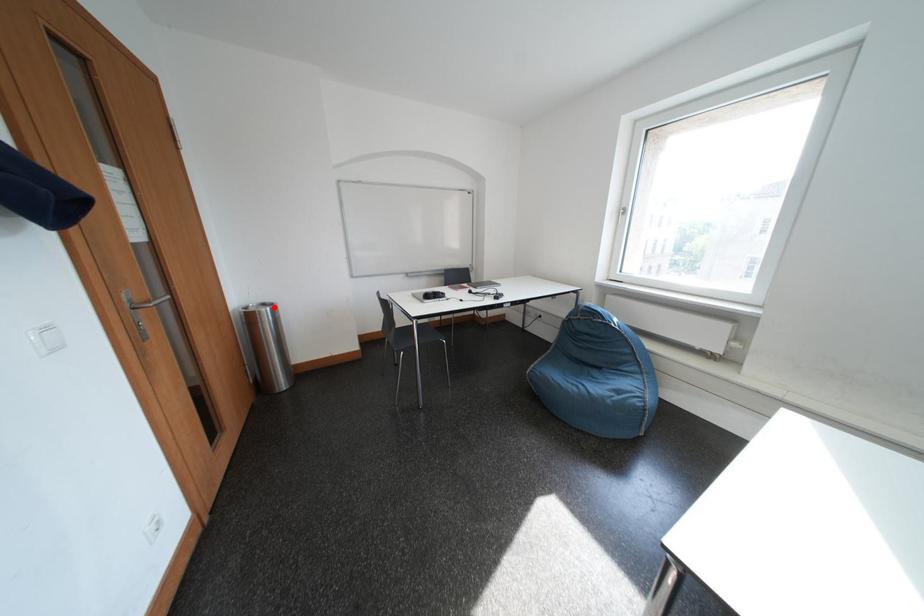
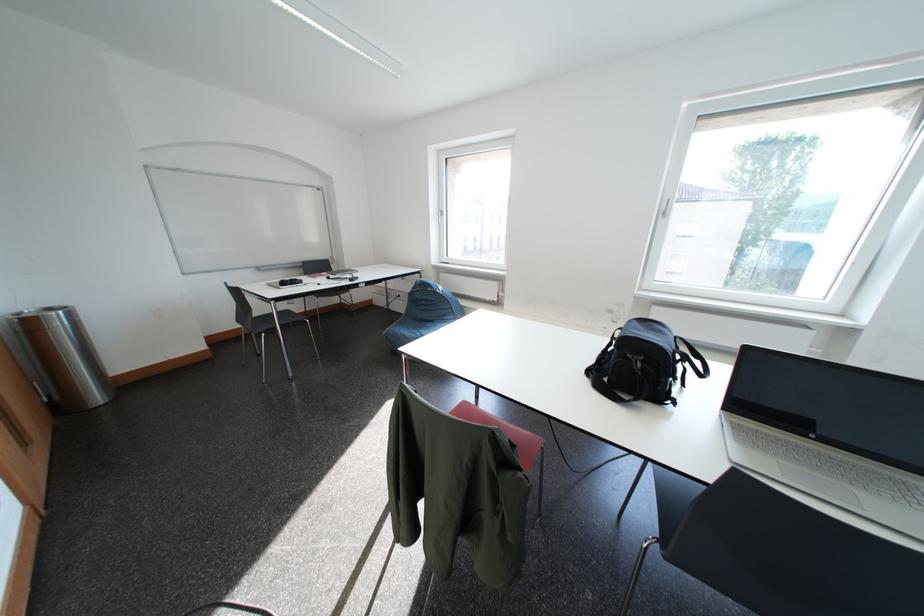
The point at the highlighted location is marked in the first image. Where is the corresponding point in the second image?

(59, 312)